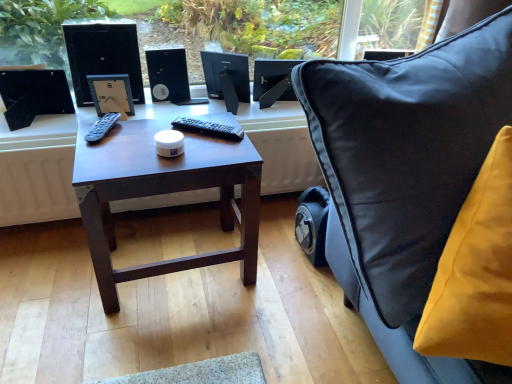
This screenshot has height=384, width=512. I want to click on vacant space in front of black plastic speaker at center, so click(163, 111).